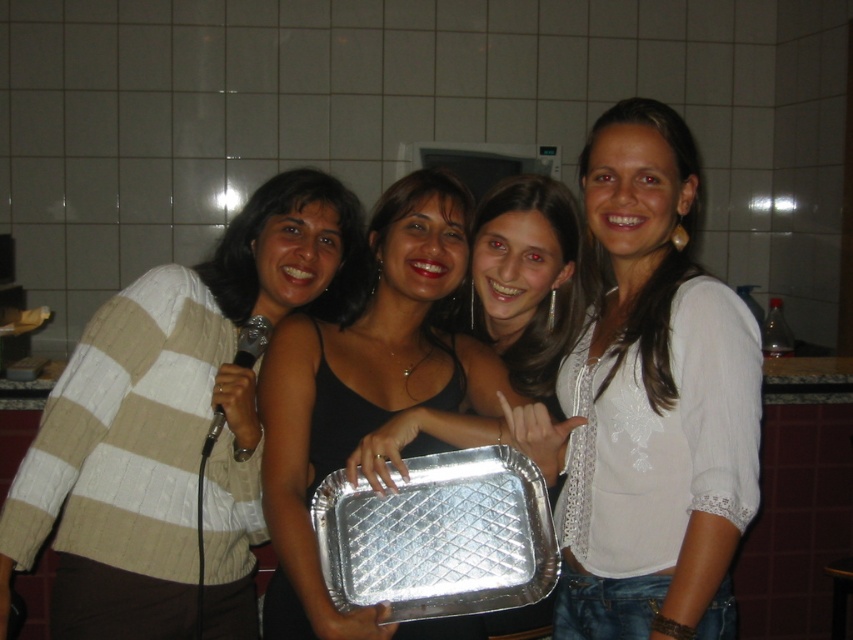
Between metallic silver tray at center and silver/aluminum tray at center, which one appears on the left side from the viewer's perspective?

Positioned to the left is silver/aluminum tray at center.

Does metallic silver tray at center come in front of silver/aluminum tray at center?

Yes, it is.

Between point (368, 464) and point (315, 508), which one is positioned behind?

Point (315, 508)

Find the location of a particular element. This screenshot has width=853, height=640. metallic silver tray at center is located at coordinates (376, 397).

From the picture: Can you confirm if white knit sweater at left is smaller than metallic silver tray at center?

Yes, white knit sweater at left is smaller than metallic silver tray at center.

Is point (91, 627) positioned behind point (368, 452)?

Yes, it is behind point (368, 452).

This screenshot has height=640, width=853. I want to click on white knit sweater at left, so click(171, 428).

Is white embroidered shirt at center smaller than silver/aluminum tray at center?

Incorrect, white embroidered shirt at center is not smaller in size than silver/aluminum tray at center.

I want to click on white embroidered shirt at center, so click(x=654, y=403).